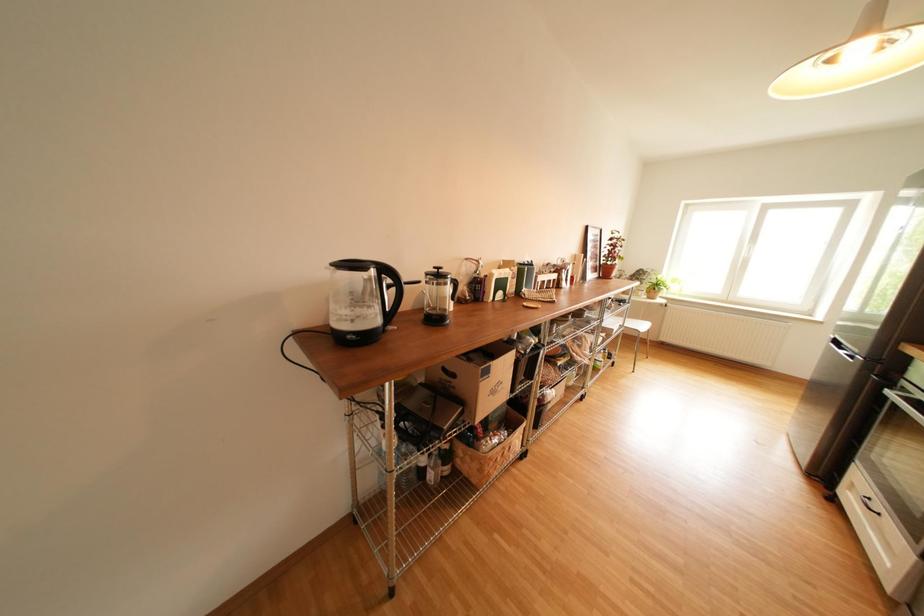
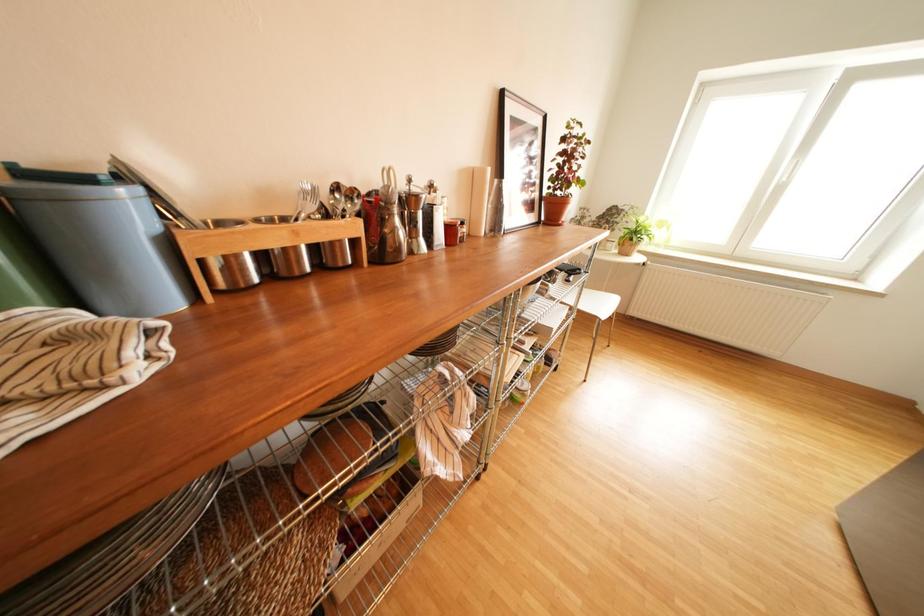
The images are taken continuously from a first-person perspective. In which direction are you moving?

The cameraman walked toward right, forward.